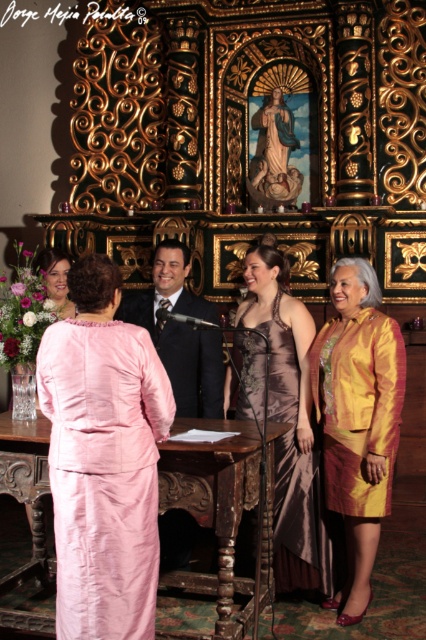
You are a photographer at the event and need to capture a closeup of the shiny black suit at center without the matte pink altar at center being visible in the shot. Is this possible given their sizes?

The matte pink altar at center is bigger than the shiny black suit at center, so it might block the view. However, since the altar is at the background and the suit is in the foreground, adjusting the camera angle to focus closely on the suit while keeping the altar out of frame could work. The size difference doesn

You are a photographer at the event and want to capture a photo of the pink silk dress at center and the gold silk skirt at right. Which one will have a longer hemline in the photo?

The gold silk skirt at right has a longer hemline than the pink silk dress at center because the pink silk dress at center is shorter than the gold silk skirt at right.